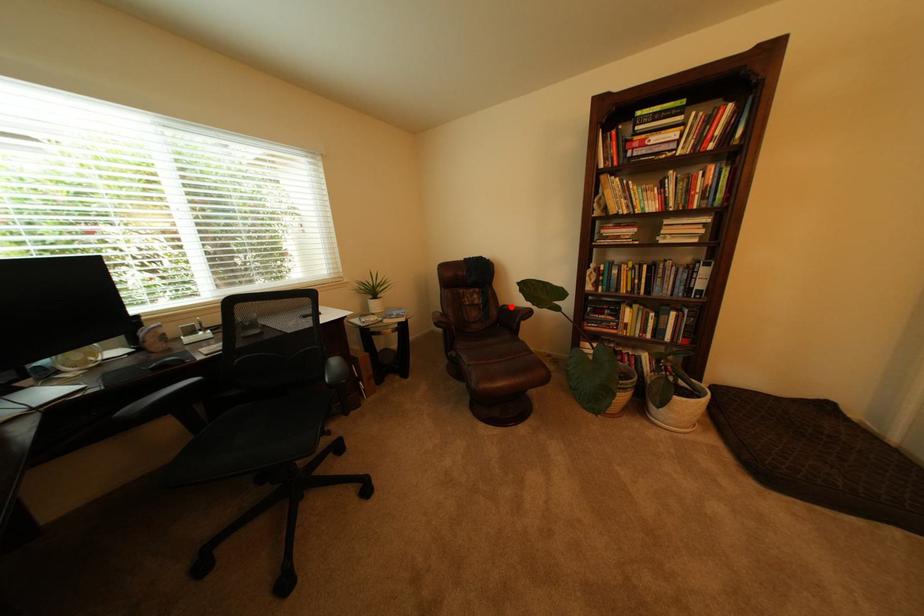
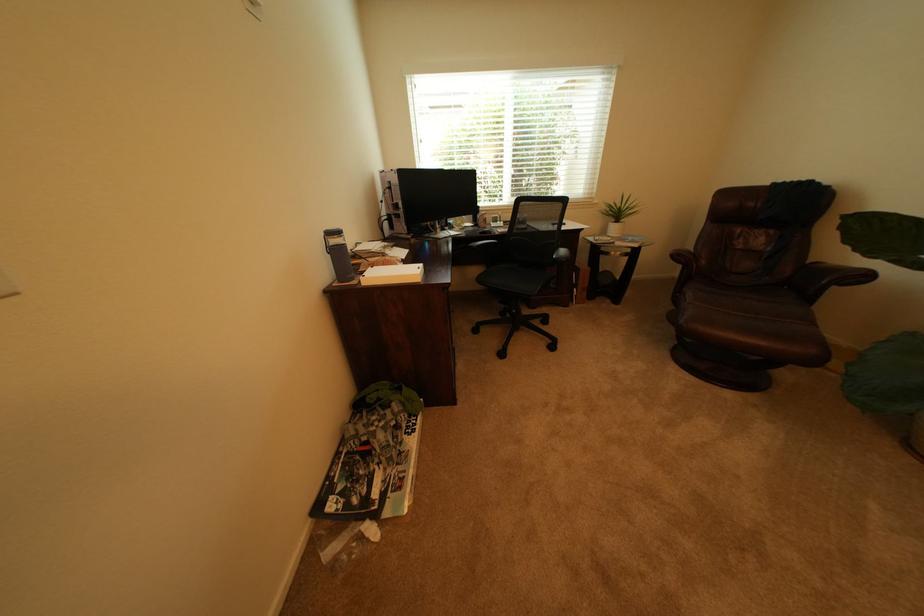
Question: I am providing you with two images of the same scene from different viewpoints. A red point is shown in image1. For the corresponding object point in image2, is it positioned nearer or farther from the camera?

Choices:
 (A) Nearer
 (B) Farther

Answer: (B)